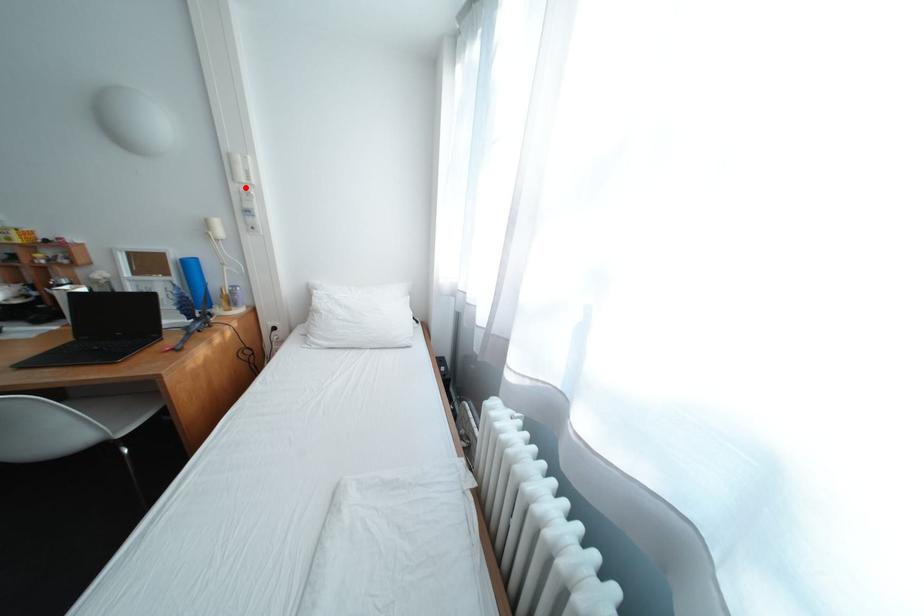
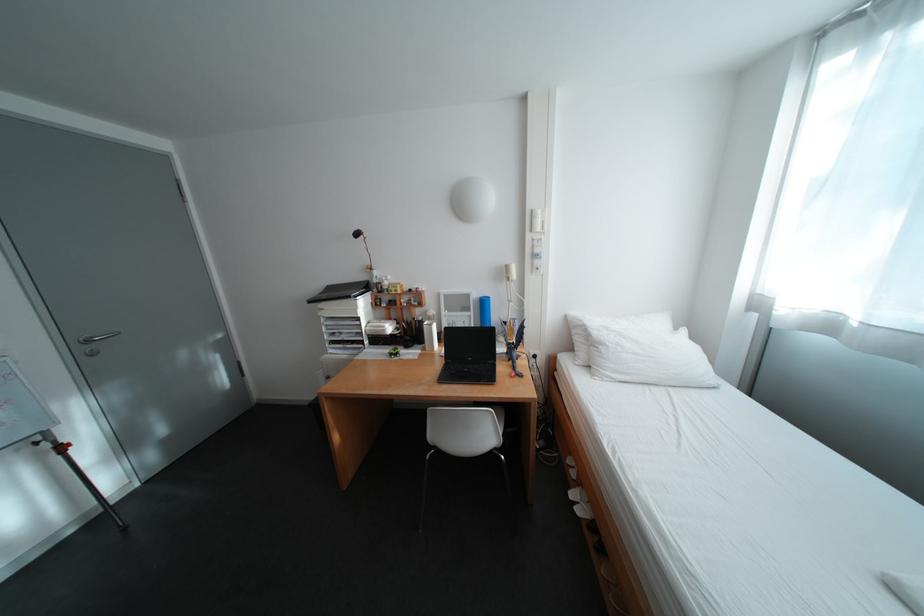
Question: I am providing you with two images of the same scene from different viewpoints. A red point is marked on the first image. At the location where the point appears in image 1, is it still visible in image 2?

Choices:
 (A) Yes
 (B) No

Answer: (A)